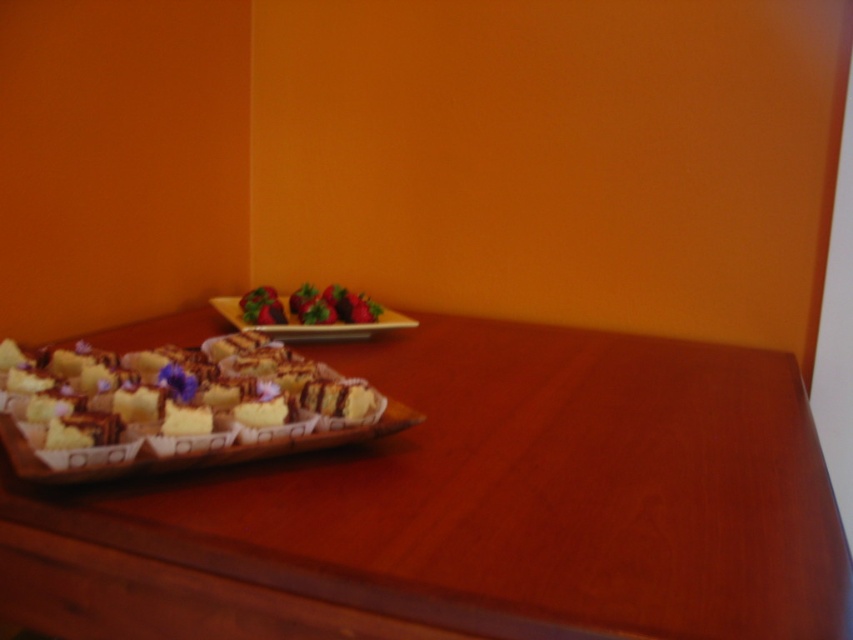
Question: Which object is farther from the camera taking this photo?

Choices:
 (A) wooden table at lower left
 (B) shiny red strawberries at center

Answer: (B)

Question: Which of the following is the farthest from the observer?

Choices:
 (A) (289, 305)
 (B) (312, 324)
 (C) (708, 454)
 (D) (201, 412)

Answer: (A)

Question: Among these points, which one is farthest from the camera?

Choices:
 (A) coord(393,326)
 (B) coord(3,371)
 (C) coord(322,298)

Answer: (C)

Question: Is wooden table at lower left positioned before shiny red strawberries at center?

Choices:
 (A) no
 (B) yes

Answer: (B)

Question: Does wooden table at lower left appear over white paper cupcake at lower left?

Choices:
 (A) yes
 (B) no

Answer: (B)

Question: Where is white paper cupcake at lower left located in relation to wooden rectangular platter at center in the image?

Choices:
 (A) above
 (B) below

Answer: (B)